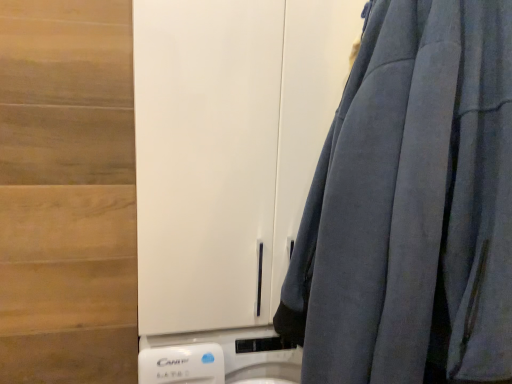
Question: From the image's perspective, is white matte cabinet at center above velvet blue curtain at right?

Choices:
 (A) yes
 (B) no

Answer: (A)

Question: Is white matte cabinet at center placed right next to velvet blue curtain at right?

Choices:
 (A) no
 (B) yes

Answer: (A)

Question: Is white matte cabinet at center far away from velvet blue curtain at right?

Choices:
 (A) yes
 (B) no

Answer: (B)

Question: Considering the relative sizes of white matte cabinet at center and velvet blue curtain at right in the image provided, is white matte cabinet at center wider than velvet blue curtain at right?

Choices:
 (A) no
 (B) yes

Answer: (B)

Question: Is white matte cabinet at center at the left side of velvet blue curtain at right?

Choices:
 (A) yes
 (B) no

Answer: (A)

Question: Considering the relative sizes of white matte cabinet at center and velvet blue curtain at right in the image provided, is white matte cabinet at center shorter than velvet blue curtain at right?

Choices:
 (A) no
 (B) yes

Answer: (B)

Question: Is velvet blue curtain at right to the left of white matte cabinet at center from the viewer's perspective?

Choices:
 (A) no
 (B) yes

Answer: (A)

Question: Does velvet blue curtain at right have a greater width compared to white matte cabinet at center?

Choices:
 (A) yes
 (B) no

Answer: (B)

Question: Considering the relative positions of velvet blue curtain at right and white matte cabinet at center in the image provided, is velvet blue curtain at right to the right of white matte cabinet at center from the viewer's perspective?

Choices:
 (A) yes
 (B) no

Answer: (A)

Question: Does velvet blue curtain at right have a lesser width compared to white matte cabinet at center?

Choices:
 (A) yes
 (B) no

Answer: (A)

Question: From a real-world perspective, is velvet blue curtain at right physically below white matte cabinet at center?

Choices:
 (A) yes
 (B) no

Answer: (A)

Question: Is velvet blue curtain at right looking in the opposite direction of white matte cabinet at center?

Choices:
 (A) yes
 (B) no

Answer: (B)

Question: Relative to velvet blue curtain at right, is white matte cabinet at center in front or behind?

Choices:
 (A) front
 (B) behind

Answer: (B)